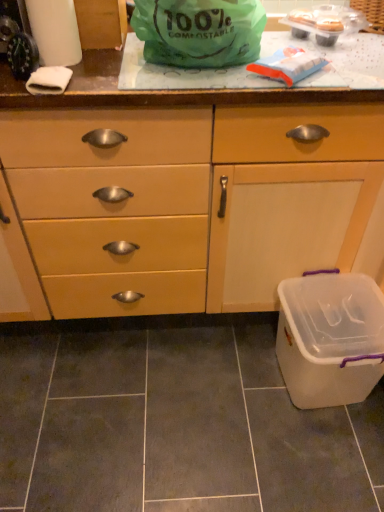
The height and width of the screenshot is (512, 384). Identify the location of vacant space to the left of white plastic container at lower right. (229, 385).